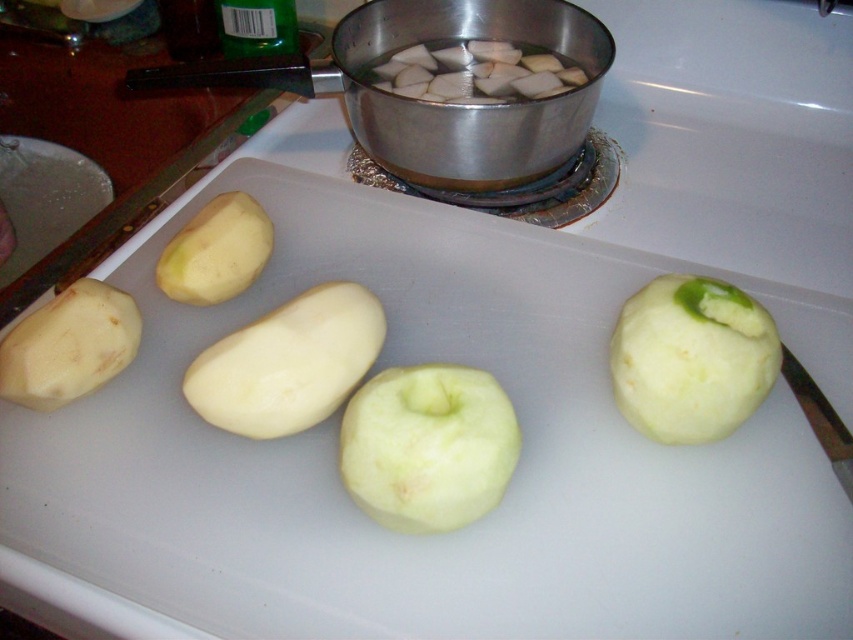
Question: Which point appears farthest from the camera in this image?

Choices:
 (A) (465, 513)
 (B) (231, 376)

Answer: (B)

Question: Is smooth white potato at center positioned before yellow matte potato at upper left?

Choices:
 (A) no
 (B) yes

Answer: (B)

Question: Is smooth white potato at center further to the viewer compared to yellow matte potato at upper left?

Choices:
 (A) no
 (B) yes

Answer: (A)

Question: Which point is closer to the camera?

Choices:
 (A) green matte apple at center
 (B) green matte apple at center-right
 (C) yellow matte potato at upper left

Answer: (A)

Question: Among these objects, which one is nearest to the camera?

Choices:
 (A) green matte apple at center-right
 (B) smooth white potato at center
 (C) smooth white potato at lower left

Answer: (B)

Question: Can you confirm if green matte apple at center is thinner than smooth white potato at lower left?

Choices:
 (A) no
 (B) yes

Answer: (A)